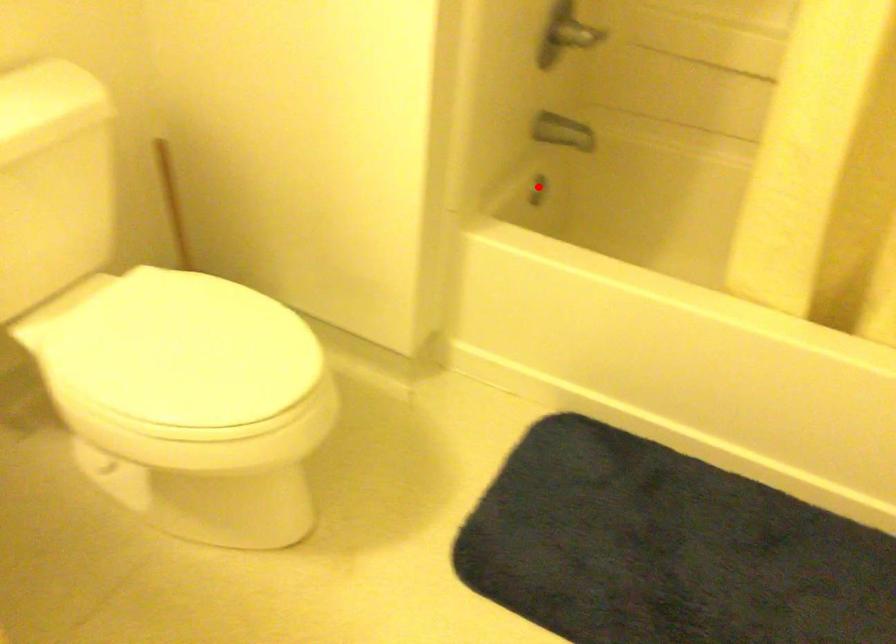
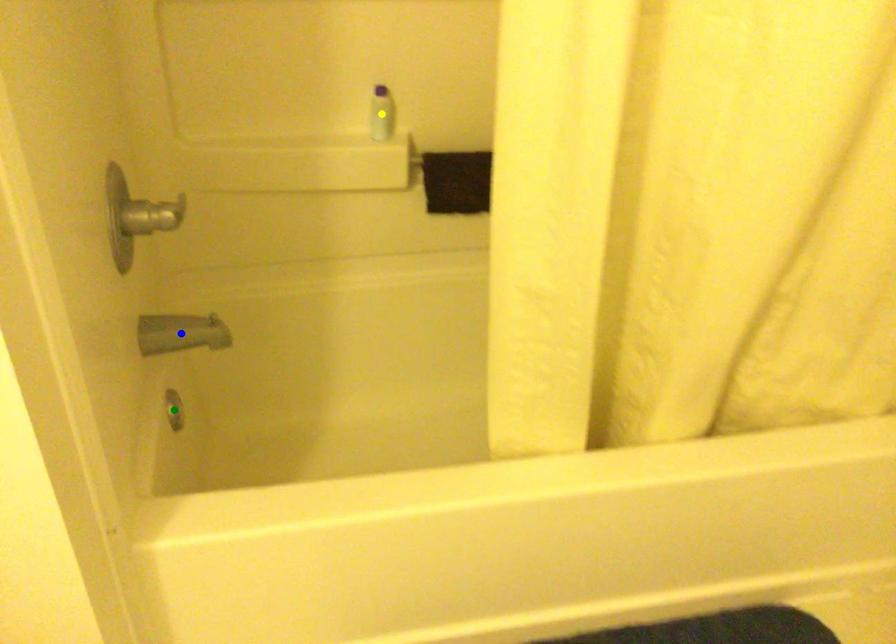
Question: I am providing you with two images of the same scene from different viewpoints. A red point is marked on the first image. You are given multiple points on the second image. Which point in image 2 is actually the same real-world point as the red point in image 1?

Choices:
 (A) blue point
 (B) green point
 (C) yellow point

Answer: (B)